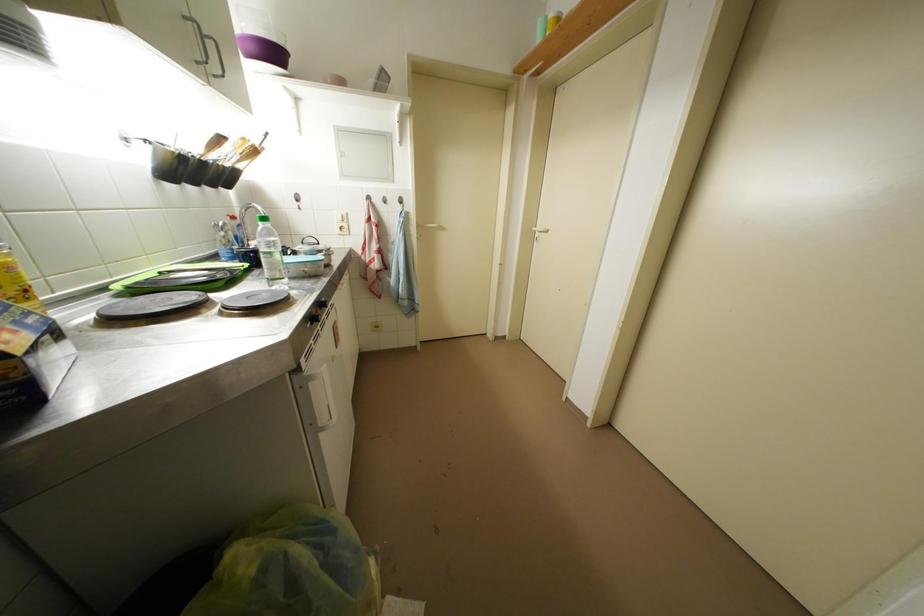
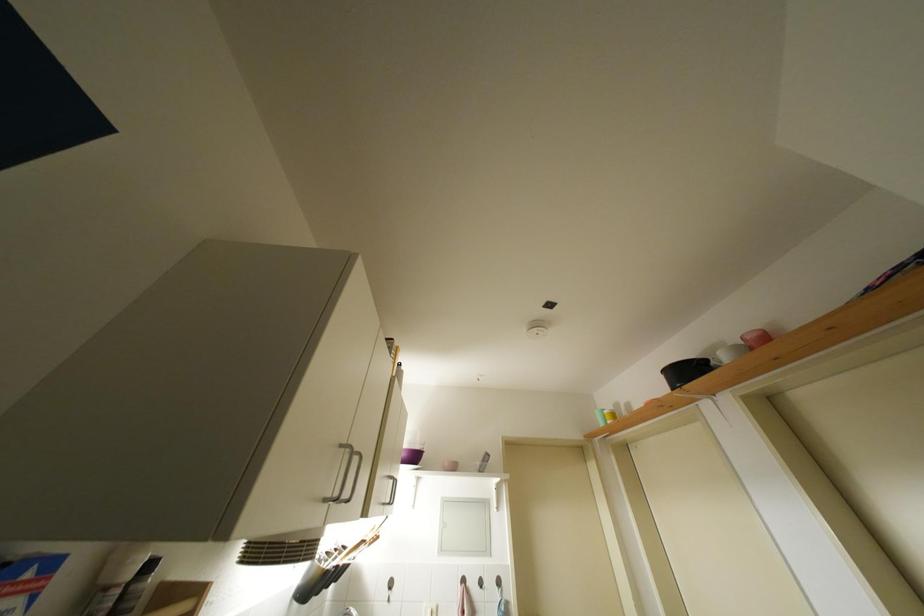
Find the pixel in the second image that matches point (350, 180) in the first image.

(447, 554)